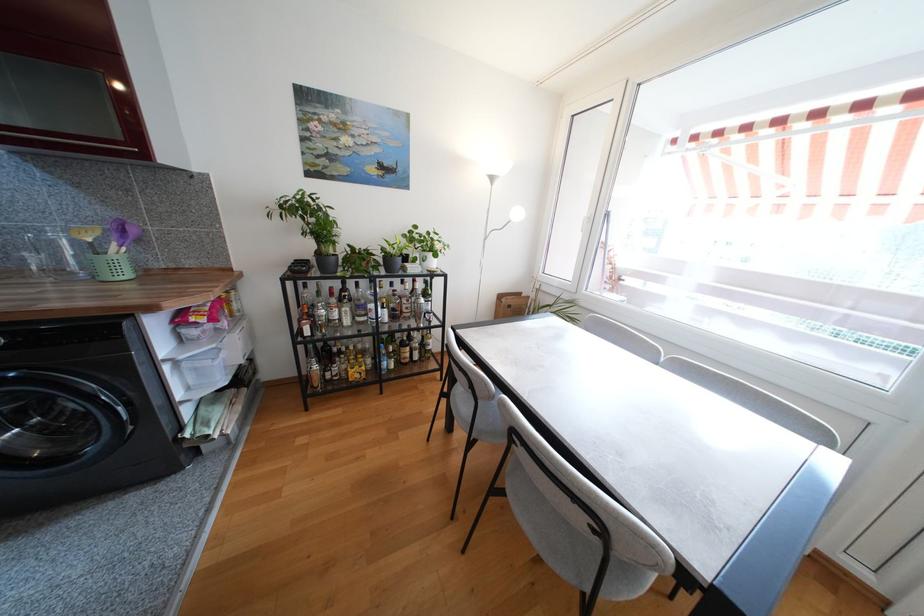
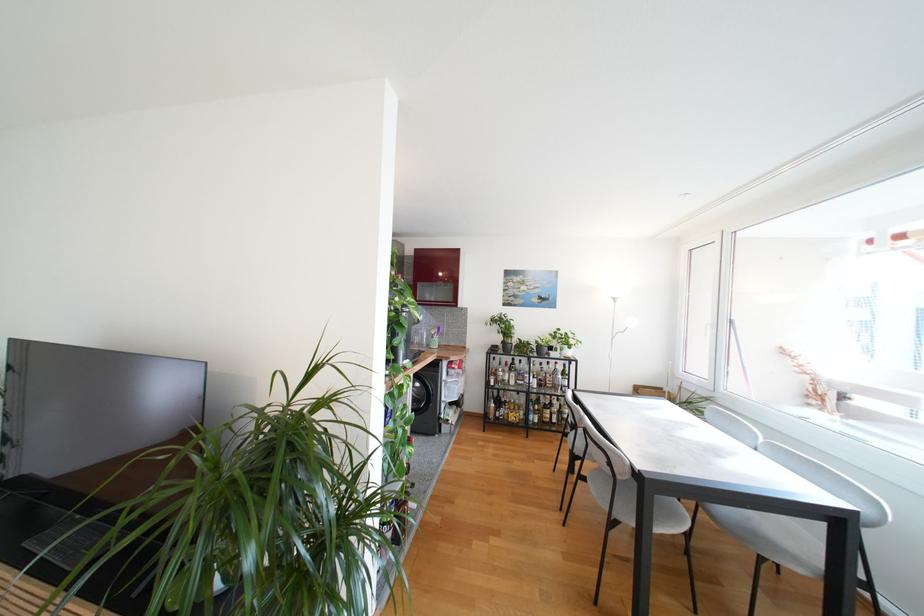
Where in the second image is the point corresponding to the point at 94,244 from the first image?

(436, 336)